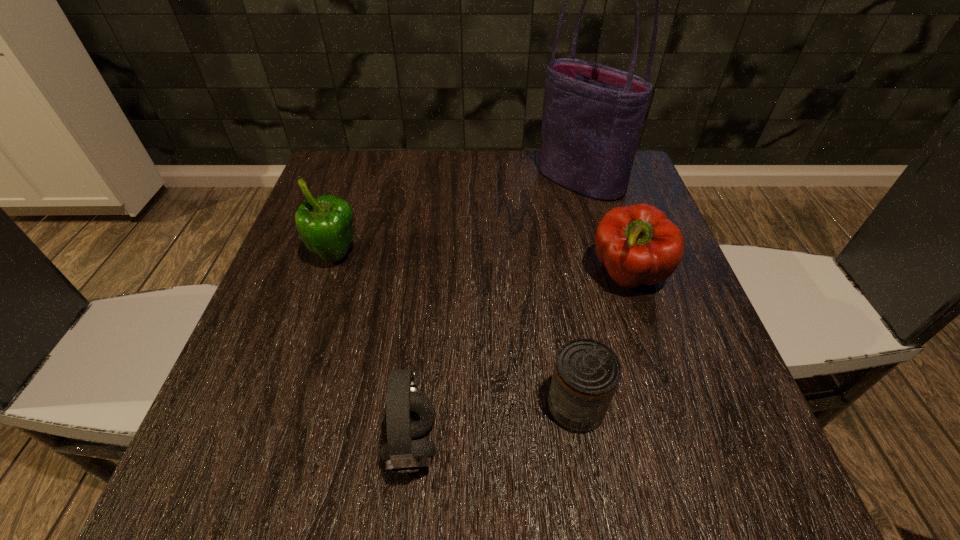
Where is `vacant space that satisfies the following two spatial constraints: 1. on the front side of the leftmost object; 2. on the left side of the right bell pepper`? vacant space that satisfies the following two spatial constraints: 1. on the front side of the leftmost object; 2. on the left side of the right bell pepper is located at coordinates (329, 275).